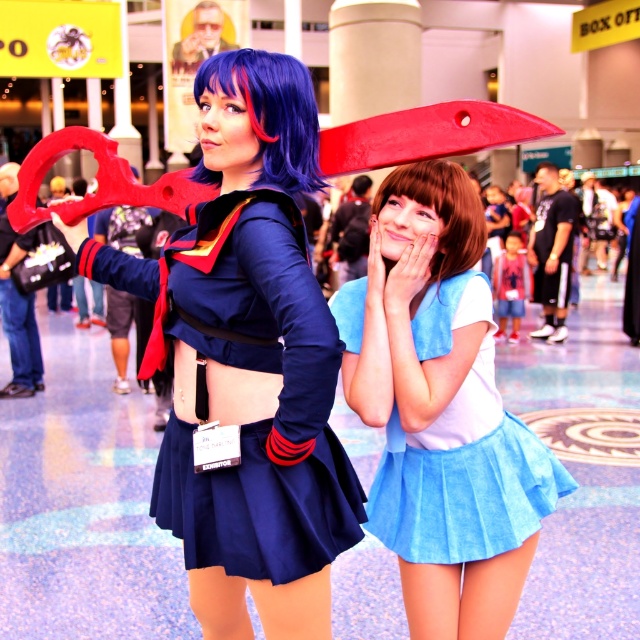
Question: Can you confirm if satin blue skirt at center is thinner than blue synthetic wig at upper center?

Choices:
 (A) yes
 (B) no

Answer: (B)

Question: Which object is farther from the camera taking this photo?

Choices:
 (A) satin blue skirt at center
 (B) matte blue fabric skirt at center
 (C) blue synthetic wig at upper center
 (D) navy blue fabric skirt at center

Answer: (A)

Question: Can you confirm if satin blue skirt at center is smaller than light blue suede skirt at lower right?

Choices:
 (A) yes
 (B) no

Answer: (A)

Question: Can you confirm if navy blue fabric skirt at center is bigger than light blue suede skirt at lower right?

Choices:
 (A) yes
 (B) no

Answer: (B)

Question: Among these objects, which one is nearest to the camera?

Choices:
 (A) blue synthetic wig at upper center
 (B) matte blue fabric skirt at center
 (C) light blue suede skirt at lower right
 (D) navy blue fabric skirt at center

Answer: (D)

Question: Which object is the closest to the navy blue fabric skirt at center?

Choices:
 (A) brown silky hair at center
 (B) blue synthetic wig at upper center
 (C) satin blue skirt at center
 (D) matte blue fabric skirt at center

Answer: (D)